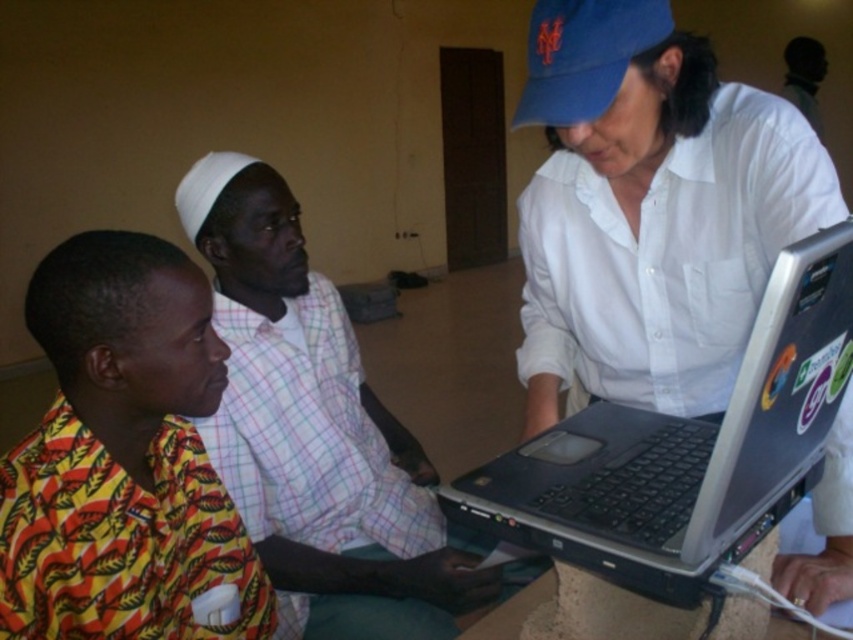
You are a photographer setting up a shoot in the room. You need to position a light source to the right of both the plaid fabric shirt at center and the dark skin man at upper right. Is this possible given their current positions?

The plaid fabric shirt at center is to the left of dark skin man at upper right, so placing a light source to the right of both is possible as long as it is positioned to the right side of the dark skin man at upper right.

Based on the scene description, where is the plaid fabric shirt at center located in the image?

The plaid fabric shirt at center is located at point [314,432].

Based on the coordinates provided, which object is located at point (314, 432) in the scene?

The point (314, 432) corresponds to the plaid fabric shirt at center.